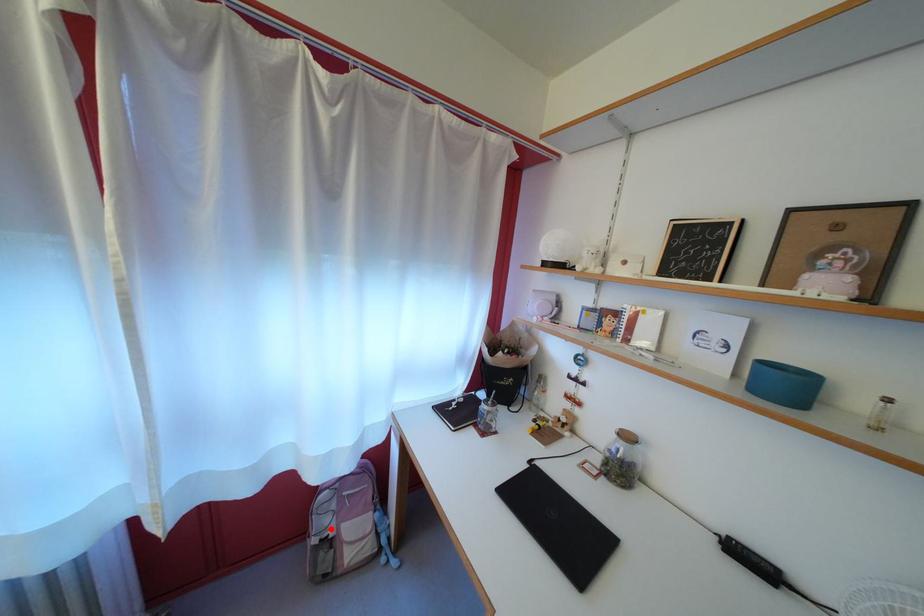
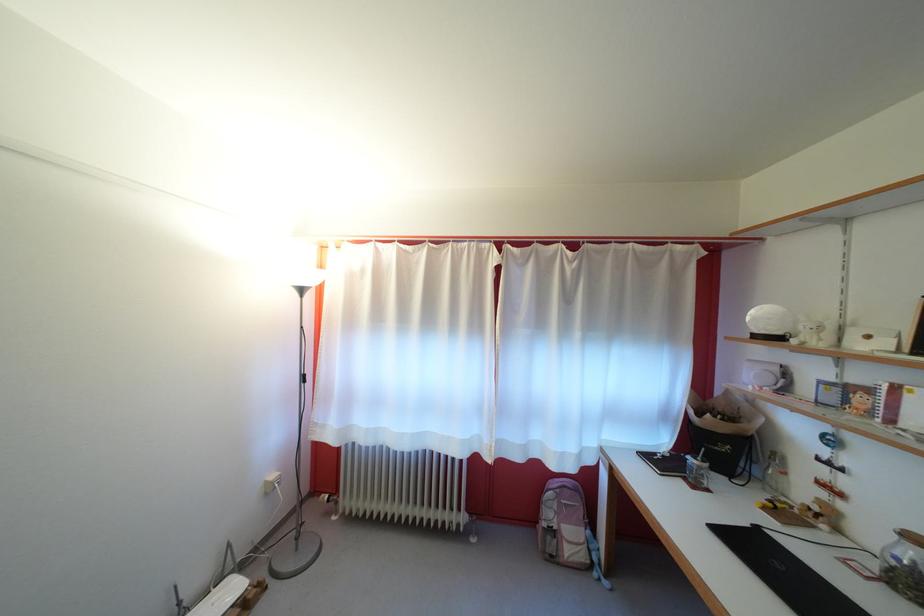
Question: I am providing you with two images of the same scene from different viewpoints. A red point is shown in image1. For the corresponding object point in image2, is it positioned nearer or farther from the camera?

Choices:
 (A) Nearer
 (B) Farther

Answer: (B)